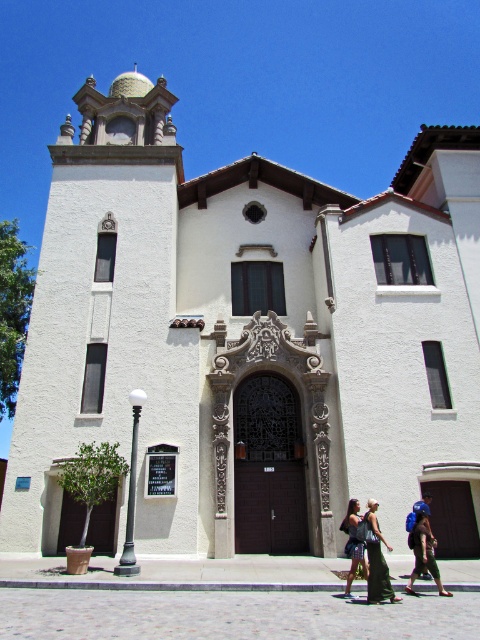
You are standing in front of the stucco building with the Mediterranean architectural style. You see a green fabric dress at lower center. Where exactly is the green fabric dress located in relation to the entrance?

The green fabric dress at lower center is located at coordinates point (x=376, y=561), which is to the right and slightly below the entrance area.

You are a delivery person standing in front of the stucco building with the arched entrance. You need to place both the dark blue denim jeans at center and the blue backpack at center on the small circular window above the entrance. Given their sizes, which item would require more space?

The dark blue denim jeans at center has a larger size compared to the blue backpack at center, so it would require more space.

You are standing in front of the Mediterranean style building and see a green fabric dress at lower center and dark blue denim jeans at center. Which clothing item is nearer to you?

The green fabric dress at lower center is closer to the viewer than dark blue denim jeans at center.